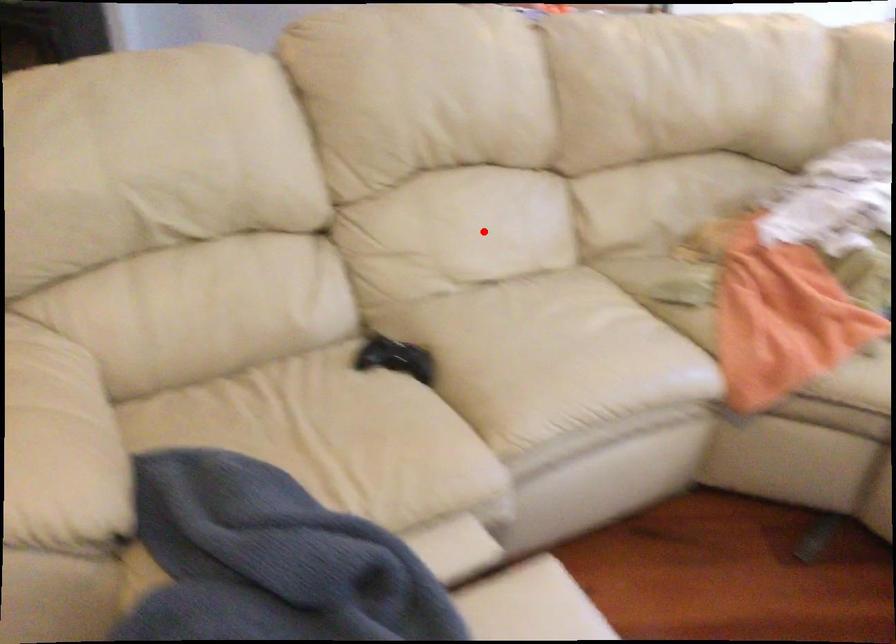
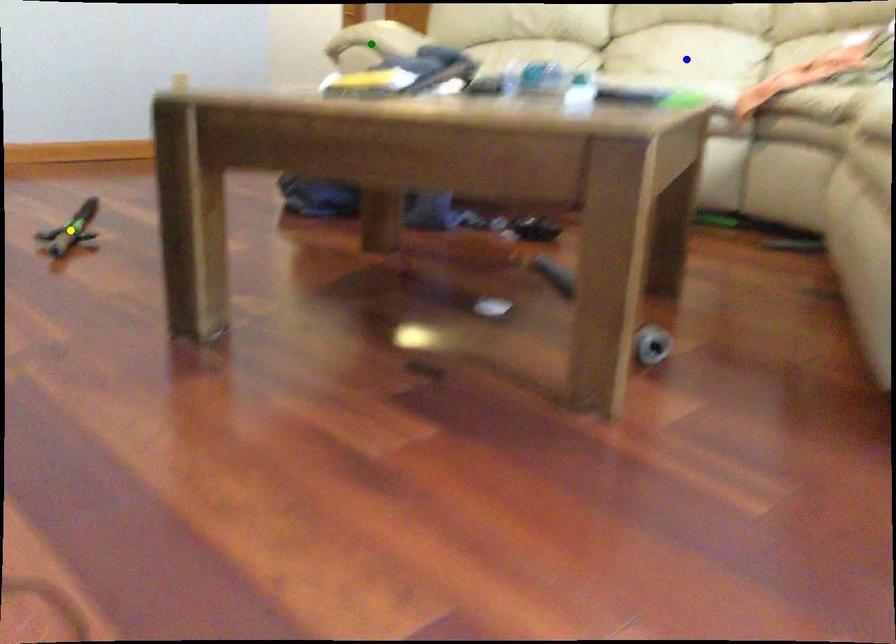
Question: I am providing you with two images of the same scene from different viewpoints. A red point is marked on the first image. You are given multiple points on the second image. Which point in image 2 is actually the same real-world point as the red point in image 1?

Choices:
 (A) blue point
 (B) yellow point
 (C) green point

Answer: (A)